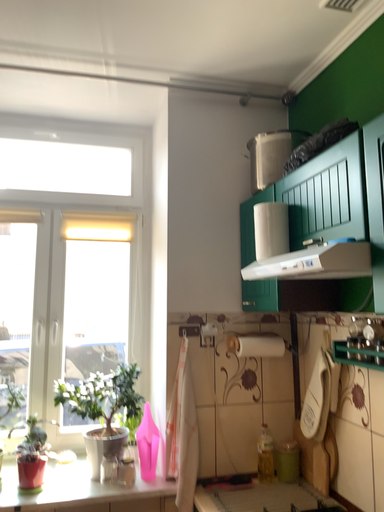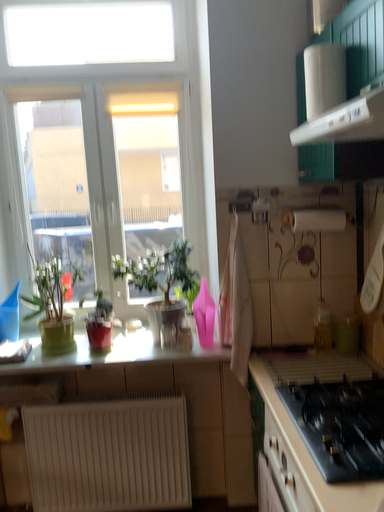
Question: How did the camera likely rotate when shooting the video?

Choices:
 (A) rotated upward
 (B) rotated downward

Answer: (B)